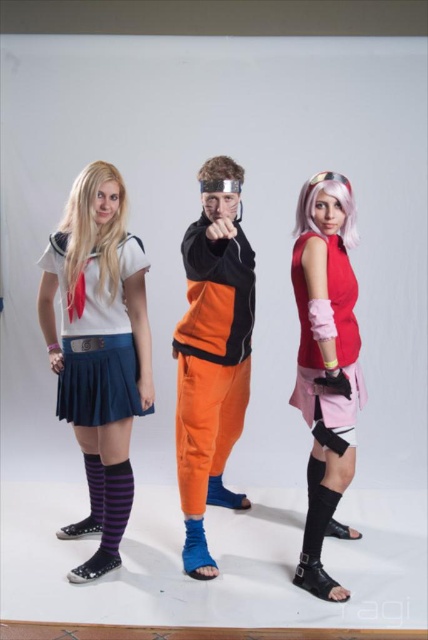
Does orange fabric pants at center have a greater width compared to purple striped sock at lower left?

Yes.

Can you confirm if orange fabric pants at center is positioned below purple striped sock at lower left?

No, orange fabric pants at center is not below purple striped sock at lower left.

The height and width of the screenshot is (640, 428). What do you see at coordinates (213, 355) in the screenshot?
I see `orange fabric pants at center` at bounding box center [213, 355].

You are a GUI agent. You are given a task and a screenshot of the screen. Output one action in this format:
    pyautogui.click(x=<x>, y=<y>)
    Task: Click on the orange fabric pants at center
    The width and height of the screenshot is (428, 640).
    Given the screenshot: What is the action you would take?
    pyautogui.click(x=213, y=355)

Which is below, satin white blouse at center or satin blue pleated skirt at left?

satin white blouse at center is lower down.

Can you confirm if satin white blouse at center is taller than satin blue pleated skirt at left?

Correct, satin white blouse at center is much taller as satin blue pleated skirt at left.

Is point (142, 362) farther from camera compared to point (124, 314)?

That is False.

This screenshot has width=428, height=640. Identify the location of satin white blouse at center. (98, 349).

From the picture: Who is more forward, (118, 465) or (205, 564)?

Point (118, 465)

Is purple striped sock at lower left further to the viewer compared to blue fabric sock at center?

That is False.

Does point (128, 474) come in front of point (216, 570)?

Yes, point (128, 474) is closer to viewer.

Find the location of a particular element. purple striped sock at lower left is located at coordinates (115, 504).